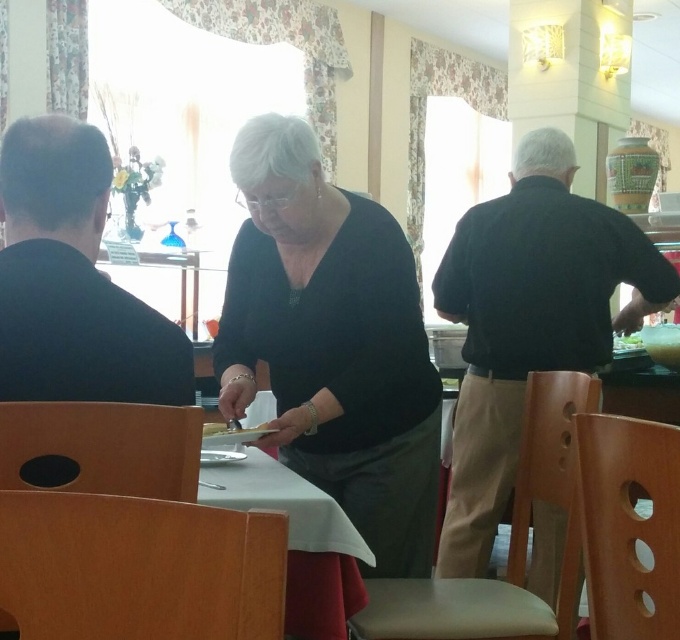
Does wooden chair at lower center appear on the left side of wooden chair at lower left?

No, wooden chair at lower center is not to the left of wooden chair at lower left.

From the picture: Who is positioned more to the left, wooden chair at lower center or wooden chair at lower left?

Positioned to the left is wooden chair at lower left.

You are a GUI agent. You are given a task and a screenshot of the screen. Output one action in this format:
    pyautogui.click(x=<x>, y=<y>)
    Task: Click on the wooden chair at lower center
    The width and height of the screenshot is (680, 640).
    Given the screenshot: What is the action you would take?
    pyautogui.click(x=137, y=566)

Who is positioned more to the right, black matte jacket at left or wooden chair at lower left?

Positioned to the right is wooden chair at lower left.

Locate an element on the screen. The height and width of the screenshot is (640, 680). black matte jacket at left is located at coordinates (71, 280).

Describe the element at coordinates (509, 544) in the screenshot. I see `light brown wooden chair at center` at that location.

What are the coordinates of `light brown wooden chair at center` in the screenshot? It's located at (509, 544).

Between point (588, 397) and point (609, 632), which one is positioned behind?

Point (588, 397)

At what (x,y) coordinates should I click in order to perform the action: click on light brown wooden chair at center. Please return your answer as a coordinate pair (x, y). The image size is (680, 640). Looking at the image, I should click on (509, 544).